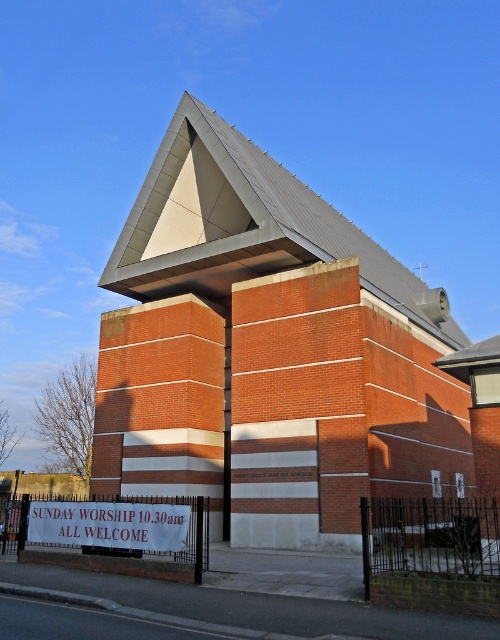
Looking at this image, you are standing in front of the church and want to read the signboard. Which object should you look at first, the brick chapel at center or the white fabric sign at lower center?

You should look at the white fabric sign at lower center first because it is closer to you than the brick chapel at center.

You are standing at the entrance of the brick chapel at center and want to place a new bench that is 2 meters long between it and the white fabric sign at lower center. Is there enough space for the bench?

The distance between the brick chapel at center and the white fabric sign at lower center is 11.89 meters. Since the bench is only 2 meters long, there is sufficient space to place it between them.